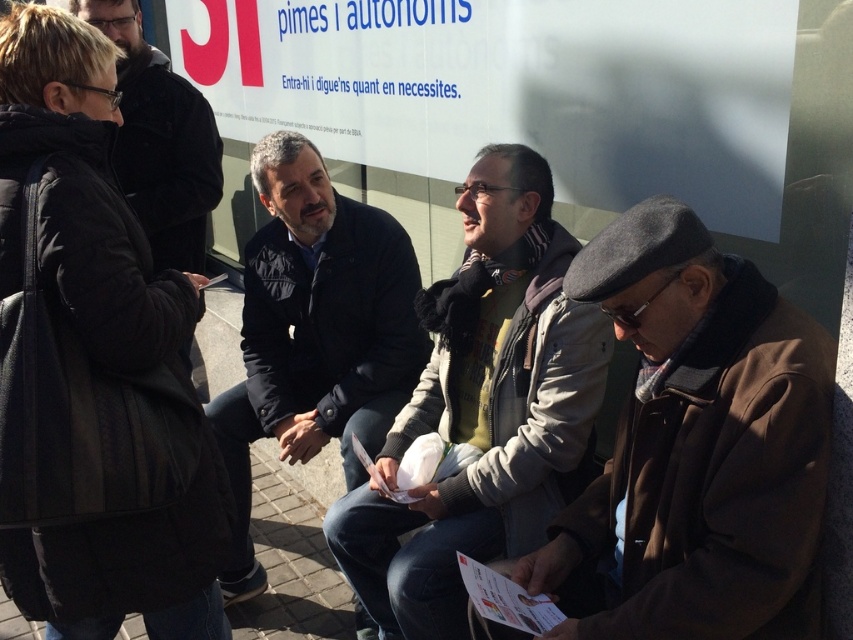
Question: Observing the image, what is the correct spatial positioning of dark blue jacket at center in reference to black matte jacket at upper left?

Choices:
 (A) left
 (B) right

Answer: (B)

Question: Considering the relative positions of light gray jacket at center and dark blue jacket at center in the image provided, where is light gray jacket at center located with respect to dark blue jacket at center?

Choices:
 (A) below
 (B) above

Answer: (A)

Question: Estimate the real-world distances between objects in this image. Which object is closer to the brown woolen jacket at center?

Choices:
 (A) light gray jacket at center
 (B) black matte jacket at upper left

Answer: (A)

Question: Which of the following is the farthest from the observer?

Choices:
 (A) (488, 368)
 (B) (160, 237)
 (C) (321, 209)
 (D) (804, 554)

Answer: (B)

Question: Does light gray jacket at center appear on the left side of dark blue jacket at center?

Choices:
 (A) no
 (B) yes

Answer: (A)

Question: Which object is closer to the camera taking this photo?

Choices:
 (A) brown woolen jacket at center
 (B) black matte jacket at upper left
 (C) dark blue jacket at center
 (D) light gray jacket at center

Answer: (A)